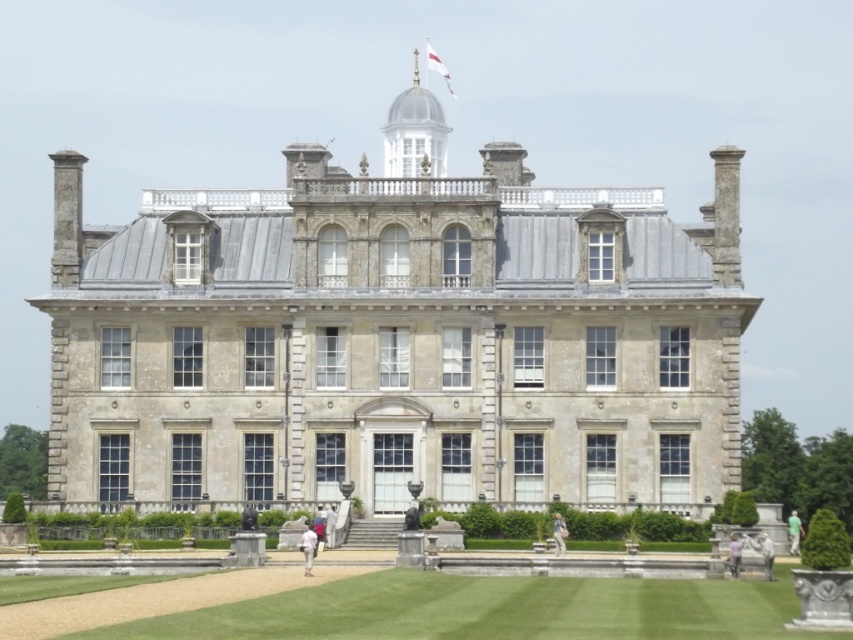
You are standing in front of the grand historic building. There is a point at coordinates (308, 548). What object is located at this point?

The point at coordinates (308, 548) corresponds to the white fabric person at center.

You are a gardener planning to place a 1.5 meter wide decorative fountain in the garden. The green grass at lower center and the light purple fabric at center are in the area. Which location would allow the fountain to fit without overlapping either object?

The green grass at lower center might be wider than light purple fabric at center, so placing the fountain on the green grass at lower center has a higher chance of fitting since it could be wider than the light purple fabric at center.